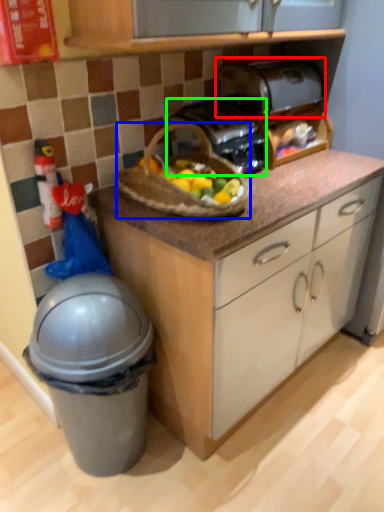
Question: Based on their relative distances, which object is farther from toaster (highlighted by a red box)? Choose from picnic basket (highlighted by a blue box) and toaster (highlighted by a green box).

Choices:
 (A) picnic basket
 (B) toaster

Answer: (A)